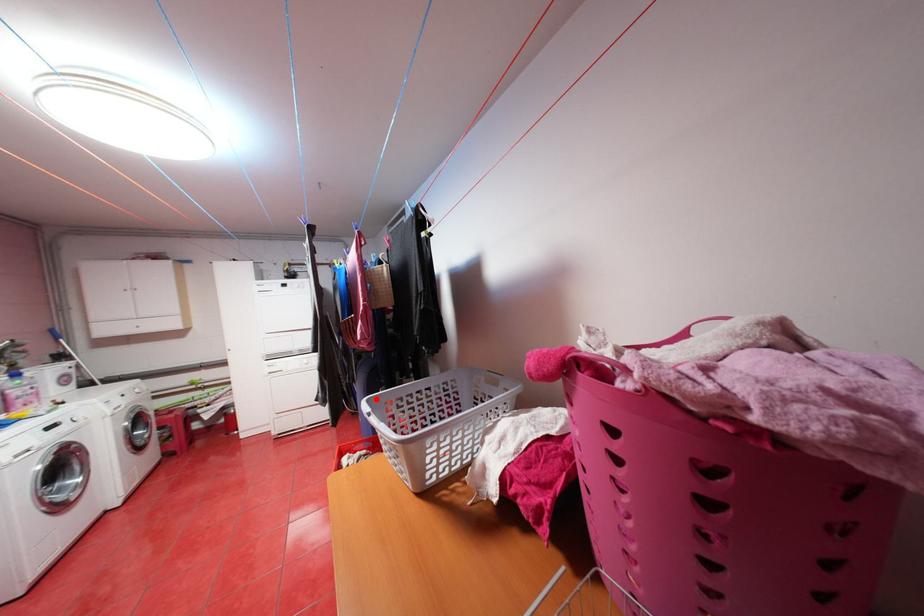
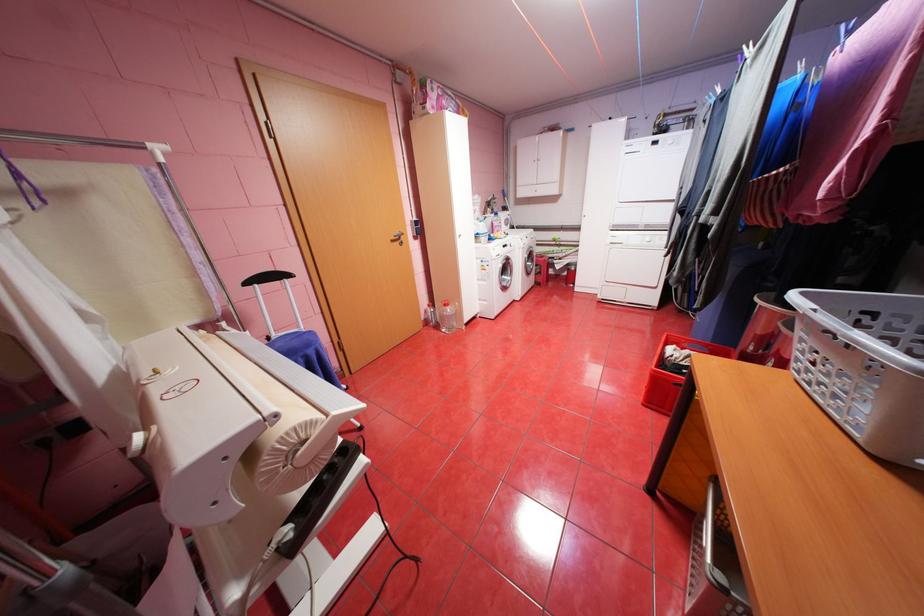
In the second image, find the point that corresponds to the highlighted location in the first image.

(811, 293)